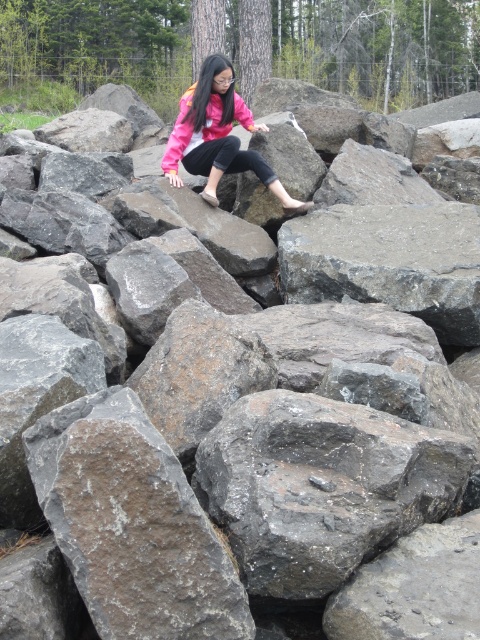
You are a hiker trying to decide which jacket to wear for a rocky terrain hike. You have two jackets available in your backpack labeled as the pink fleece jacket at center and the pink matte jacket at center. Considering the scene of navigating a pile of rocks, which jacket would be more suitable based on their widths?

The pink fleece jacket at center is wider than the pink matte jacket at center. Since the rocky terrain requires a wider jacket for better mobility, the pink fleece jacket at center would be more suitable.

You are a hiker who needs to choose between two jackets for a rocky terrain hike. The pink fleece jacket at center and the pink matte jacket at center are available. Which jacket would be more suitable for staying warm while navigating the rocky terrain shown?

The pink fleece jacket at center is bigger and therefore provides more insulation, making it more suitable for staying warm in the rocky terrain shown.

You are a hiker trying to reach a hidden waterfall. You see two jackets in the image, a pink fleece jacket at center and a pink matte jacket at center. Which jacket is positioned lower in the scene?

The pink fleece jacket at center is positioned lower than the pink matte jacket at center.